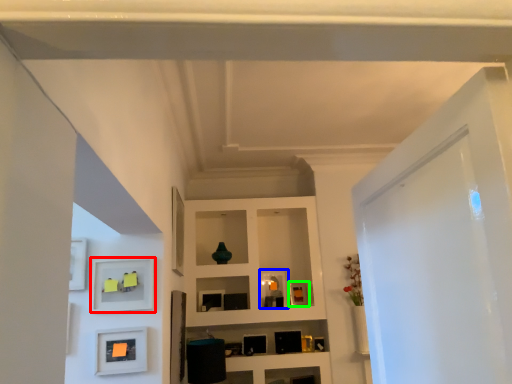
Question: Based on their relative distances, which object is farther from shelf (highlighted by a red box)? Choose from picture frame (highlighted by a blue box) and picture frame (highlighted by a green box).

Choices:
 (A) picture frame
 (B) picture frame

Answer: (B)